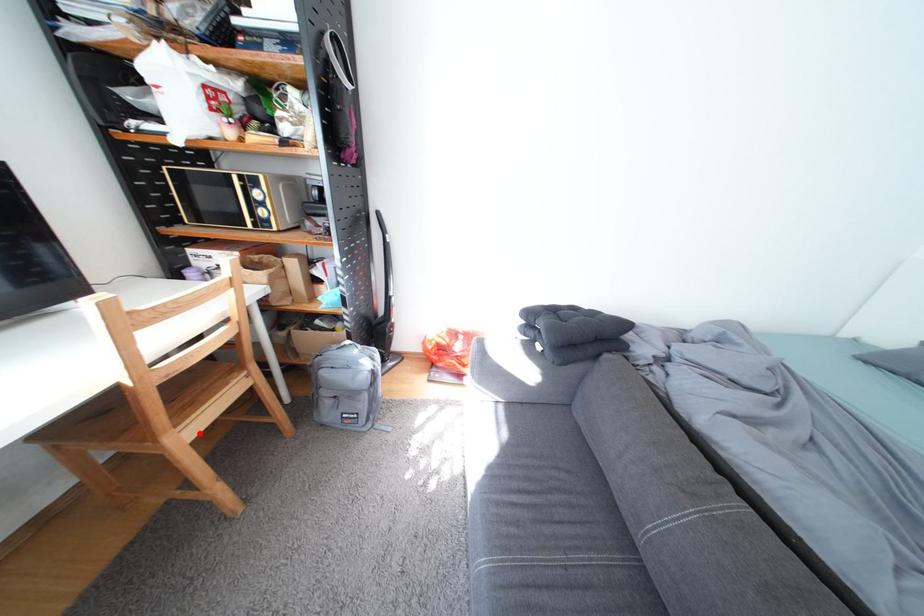
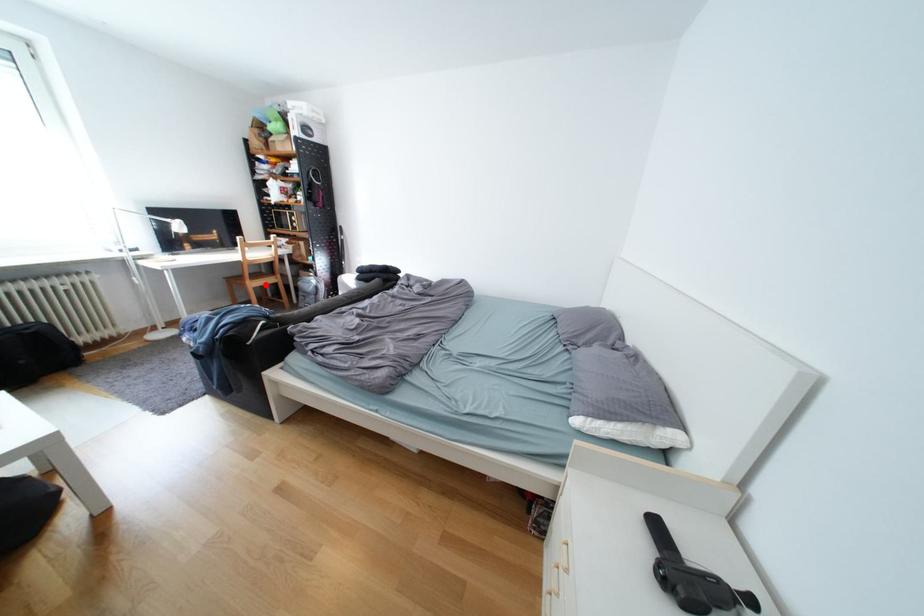
I am providing you with two images of the same scene from different viewpoints. A red point is marked on the first image and another point is marked on the second image. Are the points marked in image1 and image2 representing the same 3D position?

Yes